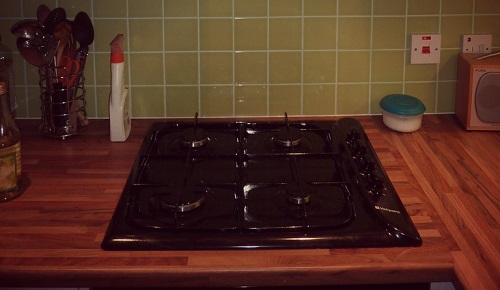
Find the location of a particular element. bottle is located at coordinates (9, 147).